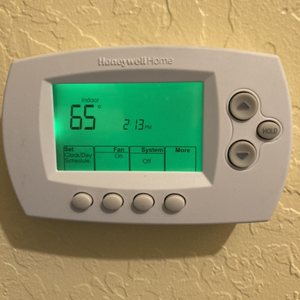
Identify the location of white area on smart thermostat. (243, 196).